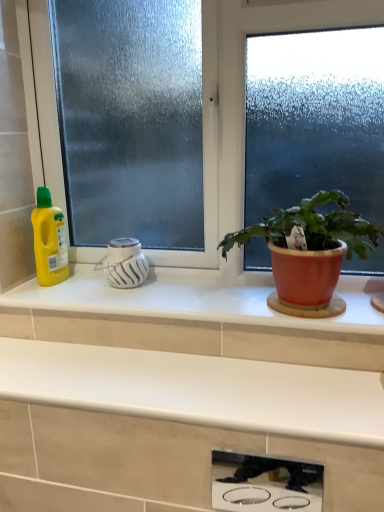
Question: Could you tell me if white glossy countertop at center, which is the 1th countertop in top-to-bottom order, is facing white matte diffuser at center, which is the second appliance from right to left?

Choices:
 (A) no
 (B) yes

Answer: (A)

Question: Can you confirm if white glossy countertop at center, acting as the second countertop starting from the bottom, is taller than white matte diffuser at center, marked as the first appliance in a left-to-right arrangement?

Choices:
 (A) yes
 (B) no

Answer: (B)

Question: Is white glossy countertop at center, acting as the second countertop starting from the bottom, looking in the opposite direction of white matte diffuser at center, which is the second appliance from right to left?

Choices:
 (A) no
 (B) yes

Answer: (A)

Question: Can you confirm if white glossy countertop at center, acting as the second countertop starting from the bottom, is bigger than white matte diffuser at center, which is the second appliance from right to left?

Choices:
 (A) yes
 (B) no

Answer: (A)

Question: Is white glossy countertop at center, acting as the second countertop starting from the bottom, next to white matte diffuser at center, which is the 2th appliance from front to back, and touching it?

Choices:
 (A) no
 (B) yes

Answer: (A)

Question: Is white glossy countertop at center, acting as the second countertop starting from the bottom, not within white matte diffuser at center, marked as the first appliance in a left-to-right arrangement?

Choices:
 (A) no
 (B) yes

Answer: (B)

Question: Could you tell me if white matte diffuser at center, which is the 2th appliance from front to back, is facing frosted glass window at center?

Choices:
 (A) no
 (B) yes

Answer: (A)

Question: From the image's perspective, is white matte diffuser at center, which is the 2th appliance from front to back, under frosted glass window at center?

Choices:
 (A) no
 (B) yes

Answer: (B)

Question: Considering the relative positions of white matte diffuser at center, which is the 1th appliance from back to front, and frosted glass window at center in the image provided, is white matte diffuser at center, which is the 1th appliance from back to front, to the left of frosted glass window at center from the viewer's perspective?

Choices:
 (A) no
 (B) yes

Answer: (B)

Question: Does white matte diffuser at center, marked as the first appliance in a left-to-right arrangement, have a lesser height compared to frosted glass window at center?

Choices:
 (A) no
 (B) yes

Answer: (B)

Question: Is white matte diffuser at center, which is the 1th appliance from back to front, further to camera compared to frosted glass window at center?

Choices:
 (A) no
 (B) yes

Answer: (B)

Question: Can you confirm if white matte diffuser at center, which is the 1th appliance from back to front, is smaller than frosted glass window at center?

Choices:
 (A) yes
 (B) no

Answer: (A)

Question: Can you see matte terracotta pot at right touching stainless steel cooktop at lower center, which is counted as the second appliance, starting from the left?

Choices:
 (A) yes
 (B) no

Answer: (B)